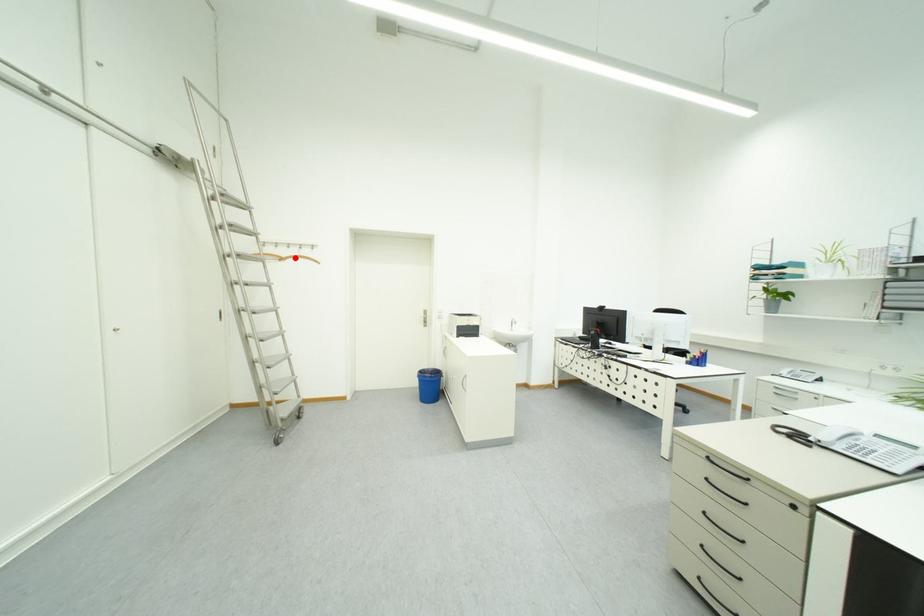
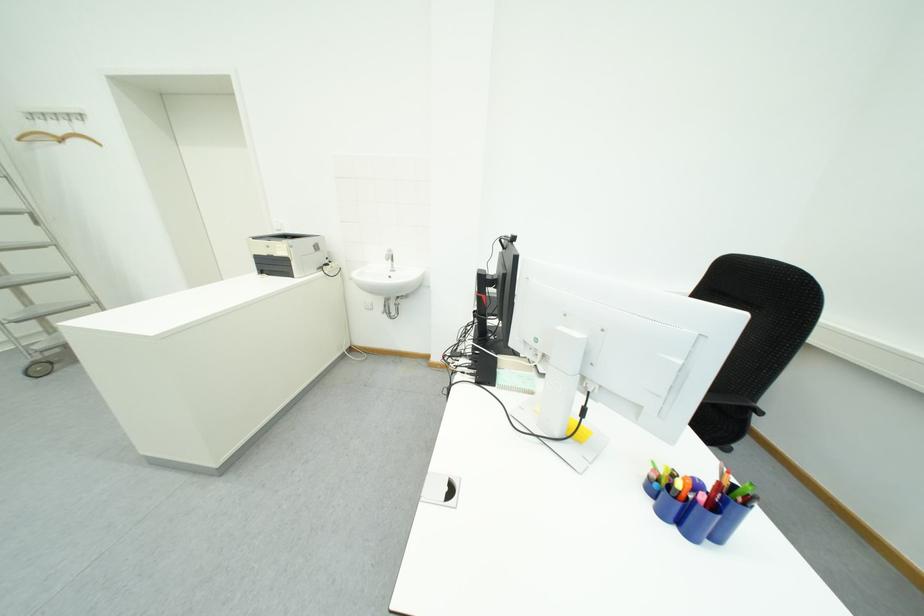
Locate, in the second image, the point that corresponds to the highlighted location in the first image.

(69, 136)